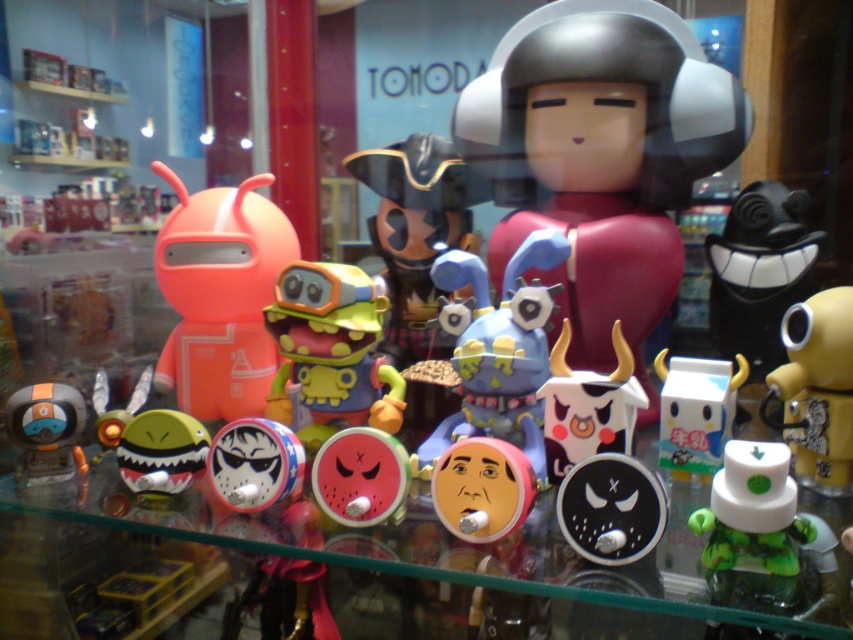
The image size is (853, 640). What do you see at coordinates (219, 296) in the screenshot? I see `matte pink toy at left` at bounding box center [219, 296].

Looking at this image, who is lower down, matte pink toy at left or green matte toy at lower right?

green matte toy at lower right

Where is `matte pink toy at left`? matte pink toy at left is located at coordinates (219, 296).

Who is positioned more to the left, matte silver helmet at center or shiny metallic shark at center?

Positioned to the left is shiny metallic shark at center.

Is point (657, 81) in front of point (201, 470)?

No, it is not.

Where is `matte silver helmet at center`? matte silver helmet at center is located at coordinates (601, 157).

Does point (173, 273) come closer to viewer compared to point (317, 467)?

No.

Find the location of `matte pink toy at left`. matte pink toy at left is located at coordinates click(x=219, y=296).